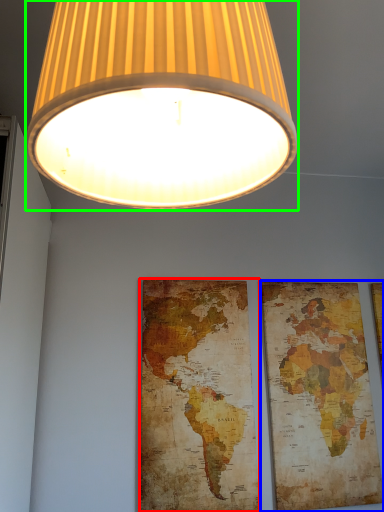
Question: Based on their relative distances, which object is farther from map (highlighted by a red box)? Choose from picture frame (highlighted by a blue box) and lamp (highlighted by a green box).

Choices:
 (A) picture frame
 (B) lamp

Answer: (B)